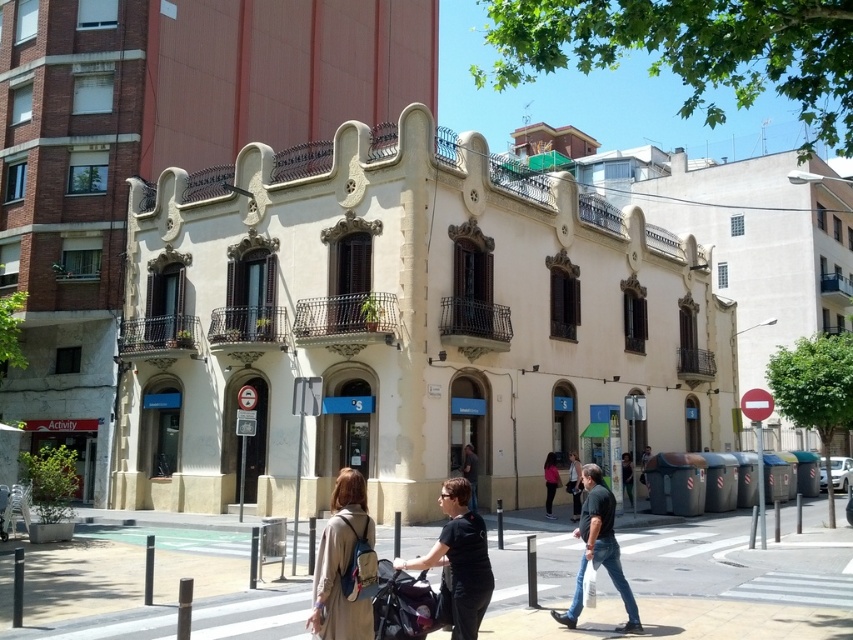
Question: Which of the following is the farthest from the observer?

Choices:
 (A) dark brown leather jacket at center
 (B) dark gray fabric baby carriage at center
 (C) matte black jacket at center
 (D) matte pink shirt at lower center

Answer: (D)

Question: Is dark gray fabric baby carriage at center bigger than dark brown leather jacket at center?

Choices:
 (A) yes
 (B) no

Answer: (B)

Question: Which point appears farthest from the camera in this image?

Choices:
 (A) click(x=693, y=566)
 (B) click(x=436, y=612)
 (C) click(x=584, y=525)
 (D) click(x=325, y=621)

Answer: (A)

Question: Can you confirm if beige fabric coat at center is smaller than matte black jacket at center?

Choices:
 (A) yes
 (B) no

Answer: (B)

Question: Where is dark green t-shirt at center located in relation to matte black jacket at center in the image?

Choices:
 (A) above
 (B) below

Answer: (A)

Question: Which object is the farthest from the dark green t-shirt at center?

Choices:
 (A) matte pink shirt at lower center
 (B) beige fabric coat at center
 (C) dark gray fabric baby carriage at center

Answer: (A)